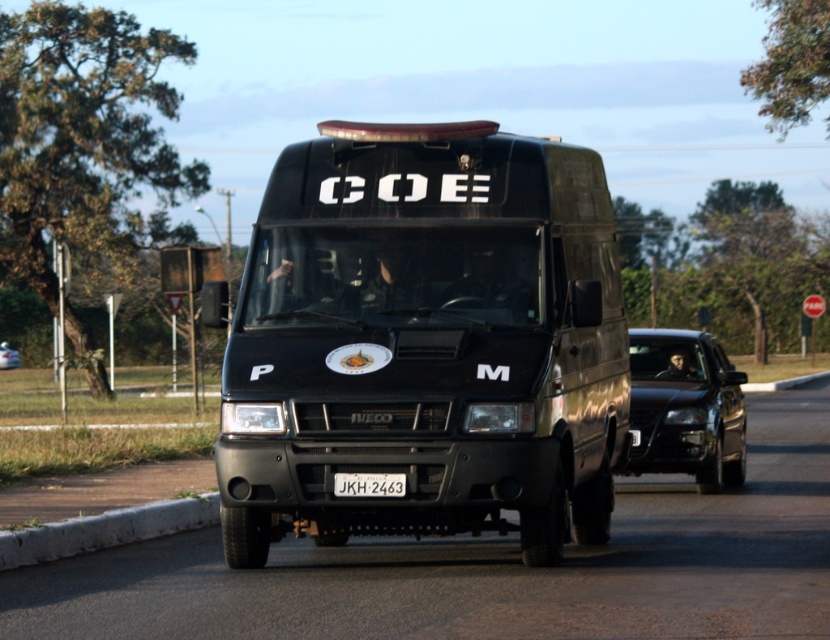
You are a traffic officer observing a road with a black glossy sedan at center and a satin black van at center. Which vehicle is bigger?

The black glossy sedan at center is larger in size compared to the satin black van at center.